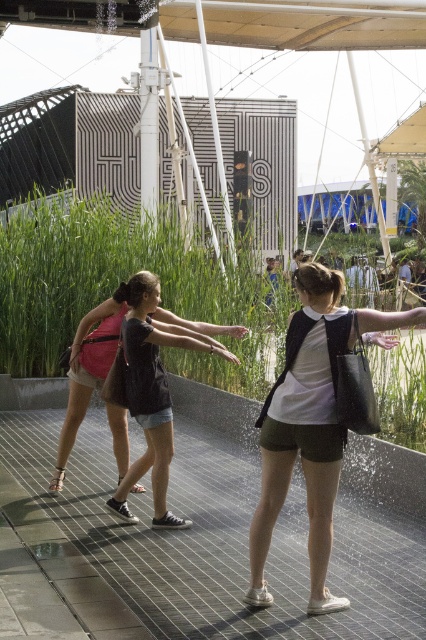
What is located at the coordinates point (305, 432)?

The point (305, 432) indicates the location of the matte black tote bag at center.

You are standing at the point with coordinates point (135, 522) and want to move towards the point with coordinates point (311, 384). Which direction should you move in?

You should move towards the point (311, 384), which is closer to the viewer than point (135, 522).